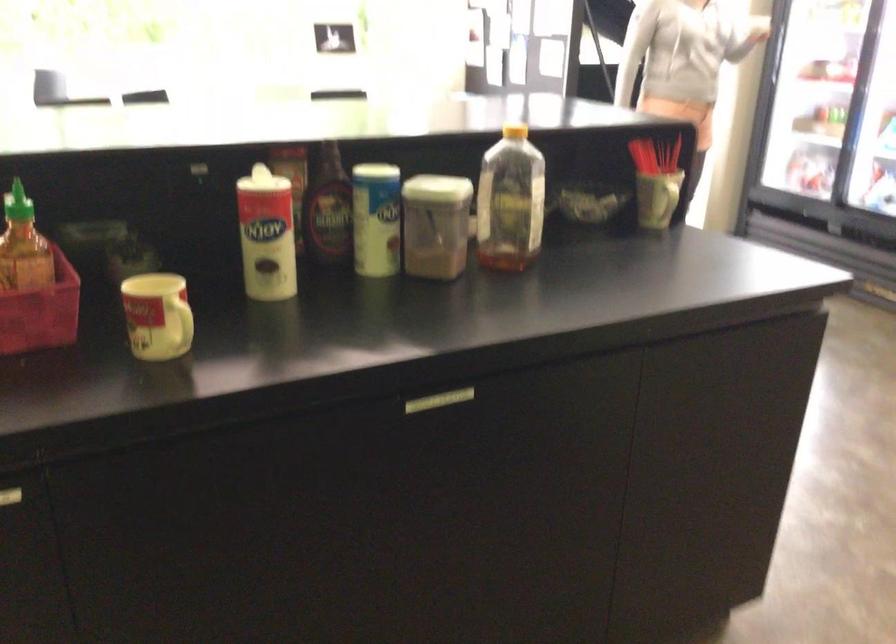
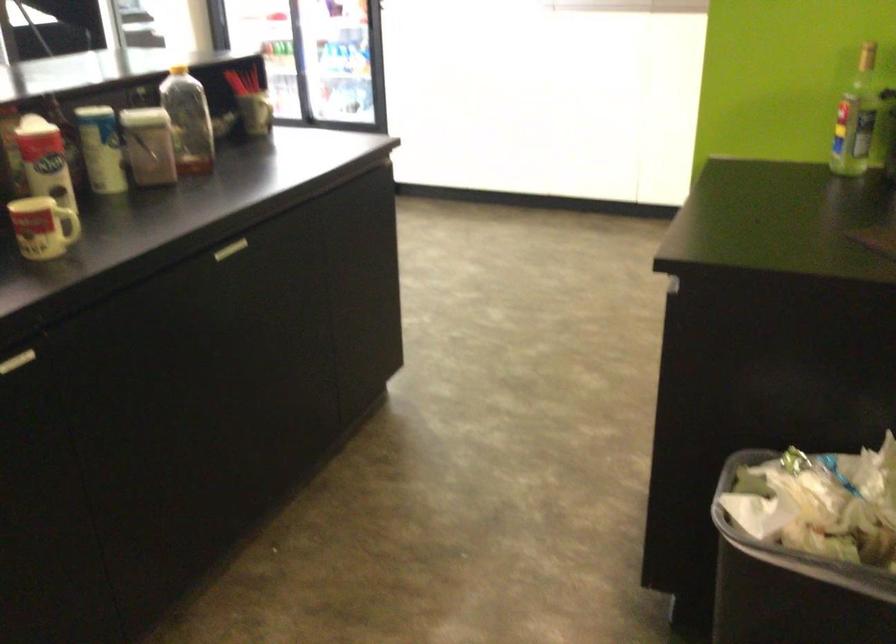
Find the pixel in the second image that matches pixel 411 218 in the first image.

(149, 146)